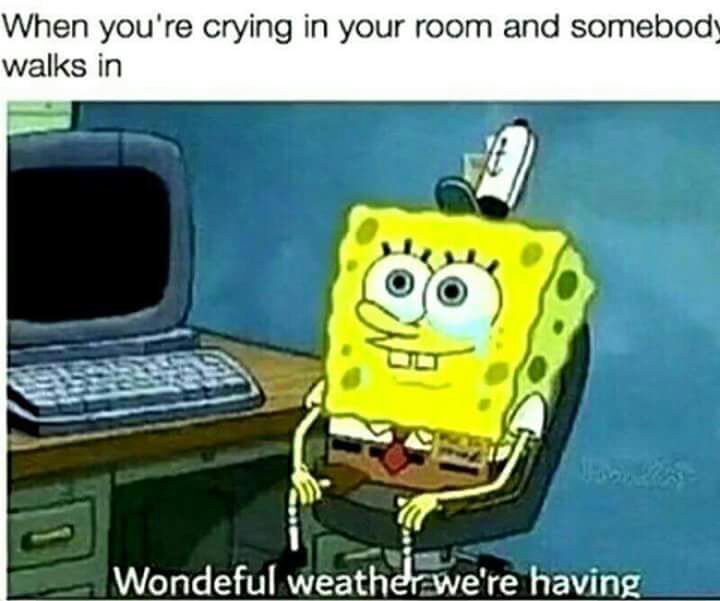
Image resolution: width=720 pixels, height=601 pixels. I want to click on computer screen, so click(x=91, y=246).